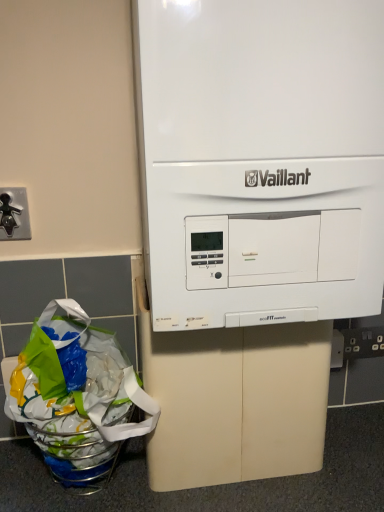
Question: From the image's perspective, would you say white matte vaillant boiler at center is shown under translucent plastic grocery bag at lower left?

Choices:
 (A) no
 (B) yes

Answer: (A)

Question: Can you confirm if white matte vaillant boiler at center is shorter than translucent plastic grocery bag at lower left?

Choices:
 (A) no
 (B) yes

Answer: (A)

Question: Does white matte vaillant boiler at center appear on the right side of translucent plastic grocery bag at lower left?

Choices:
 (A) no
 (B) yes

Answer: (B)

Question: Considering the relative sizes of white matte vaillant boiler at center and translucent plastic grocery bag at lower left in the image provided, is white matte vaillant boiler at center taller than translucent plastic grocery bag at lower left?

Choices:
 (A) no
 (B) yes

Answer: (B)

Question: Considering the relative positions of white matte vaillant boiler at center and translucent plastic grocery bag at lower left in the image provided, is white matte vaillant boiler at center to the left of translucent plastic grocery bag at lower left from the viewer's perspective?

Choices:
 (A) no
 (B) yes

Answer: (A)

Question: In the image, is white plastic electric outlet at lower right on the left side or the right side of white matte vaillant boiler at center?

Choices:
 (A) right
 (B) left

Answer: (A)

Question: Looking at their shapes, would you say white plastic electric outlet at lower right is wider or thinner than white matte vaillant boiler at center?

Choices:
 (A) thin
 (B) wide

Answer: (A)

Question: Is white plastic electric outlet at lower right spatially inside white matte vaillant boiler at center, or outside of it?

Choices:
 (A) outside
 (B) inside

Answer: (A)

Question: In terms of height, does white plastic electric outlet at lower right look taller or shorter compared to white matte vaillant boiler at center?

Choices:
 (A) tall
 (B) short

Answer: (B)

Question: Choose the correct answer: Is white matte vaillant boiler at center inside translucent plastic grocery bag at lower left or outside it?

Choices:
 (A) inside
 (B) outside

Answer: (B)

Question: From a real-world perspective, is white matte vaillant boiler at center above or below translucent plastic grocery bag at lower left?

Choices:
 (A) below
 (B) above

Answer: (B)

Question: Looking at the image, does white matte vaillant boiler at center seem bigger or smaller compared to translucent plastic grocery bag at lower left?

Choices:
 (A) small
 (B) big

Answer: (B)

Question: Would you say white matte vaillant boiler at center is to the left or to the right of translucent plastic grocery bag at lower left in the picture?

Choices:
 (A) right
 (B) left

Answer: (A)

Question: Relative to black metal faucet at left, is white plastic electric outlet at lower right in front or behind?

Choices:
 (A) front
 (B) behind

Answer: (B)

Question: Based on their positions, is white plastic electric outlet at lower right located to the left or right of black metal faucet at left?

Choices:
 (A) right
 (B) left

Answer: (A)